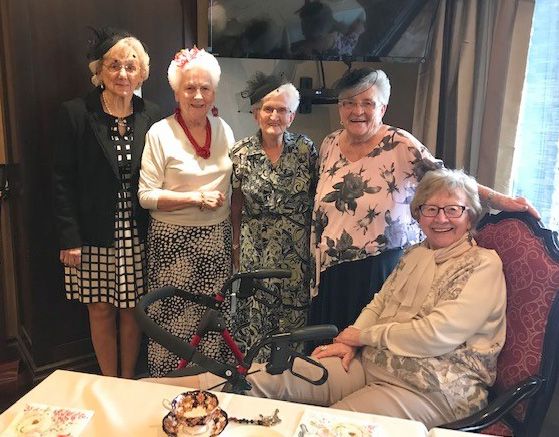
The image size is (559, 437). I want to click on curtain, so click(486, 78).